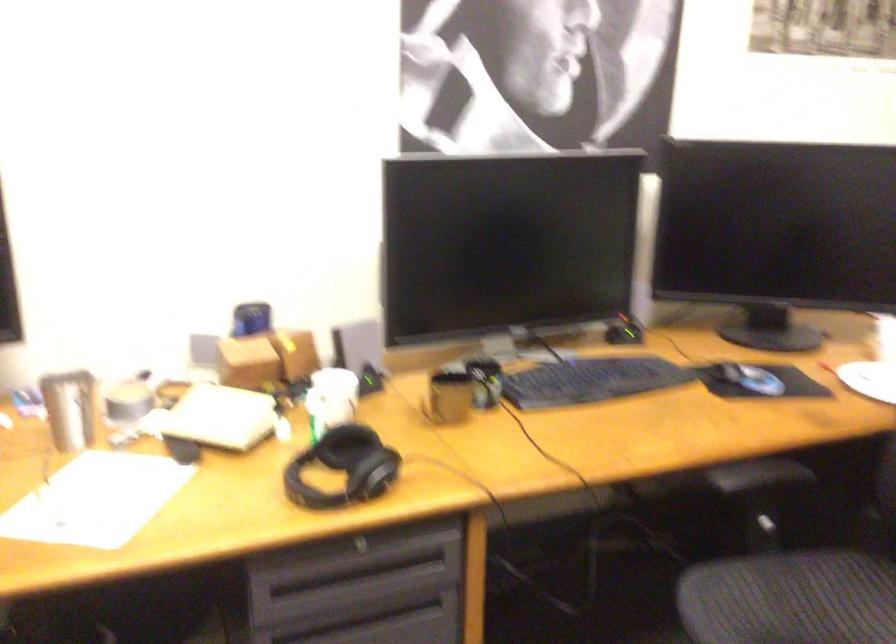
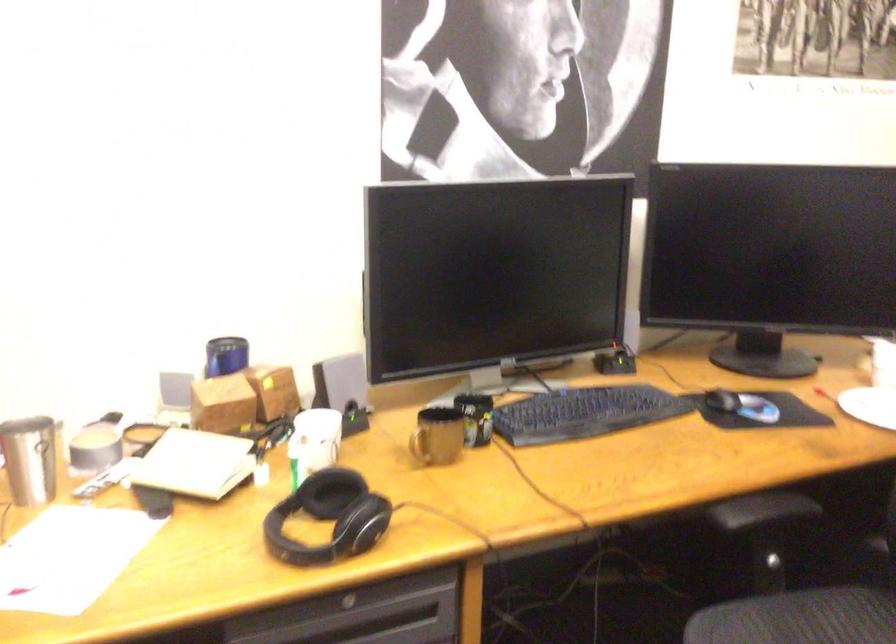
Locate, in the second image, the point that corresponds to (x=791, y=571) in the first image.

(805, 612)